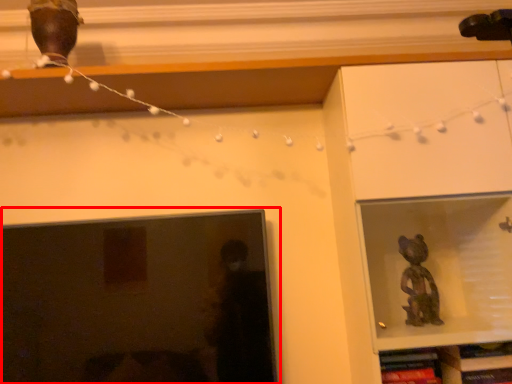
Question: Considering the relative positions of picture frame (annotated by the red box) and shelf in the image provided, where is picture frame (annotated by the red box) located with respect to the staircase?

Choices:
 (A) left
 (B) right

Answer: (A)